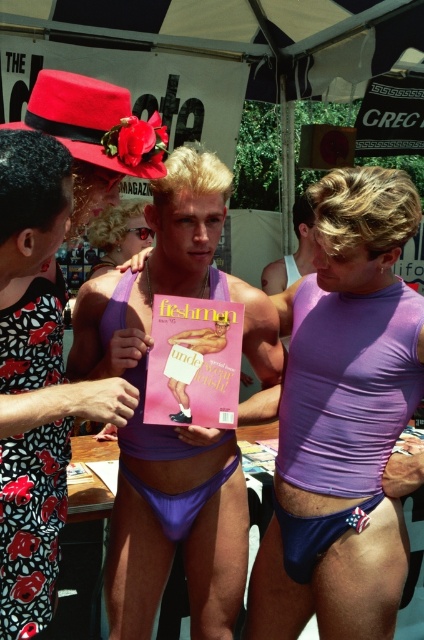
What is the location of the point with coordinates (343, 419) in the scene?

The point with coordinates (343, 419) is located on the purple matte underwear at center.

You are a photographer at the event and need to capture a clear shot of both the purple matte underwear at center and the blue satin thong at lower center. Which one will appear larger in your photo?

The purple matte underwear at center will appear larger in the photo because it is closer to the viewer than the blue satin thong at lower center.

You are a photographer at the event and need to position a light source above the purple matte bikini top at center and the blonde hair wig at center. Based on their positions, which object should the light be placed above to illuminate both effectively?

The light should be placed above the blonde hair wig at center because the purple matte bikini top at center is below it, ensuring both are illuminated when the light is positioned higher.